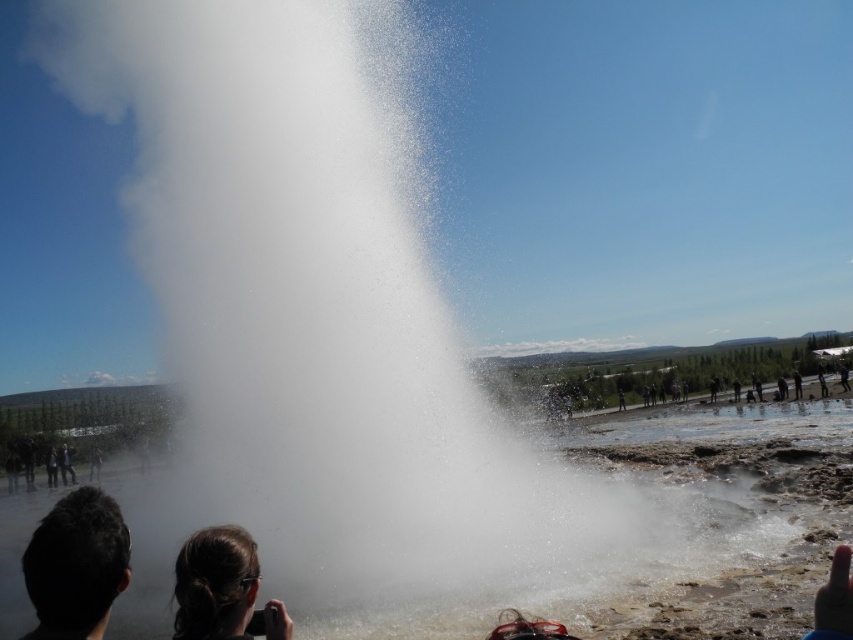
Question: Which of these objects is positioned farthest from the white vapor at center?

Choices:
 (A) dark brown leather jacket at lower left
 (B) dark brown hair at lower left

Answer: (A)

Question: Can you confirm if white vapor at center is wider than dark brown leather jacket at lower left?

Choices:
 (A) yes
 (B) no

Answer: (A)

Question: Which point is closer to the camera?

Choices:
 (A) dark brown leather jacket at lower left
 (B) white vapor at center

Answer: (B)

Question: Is white vapor at center bigger than dark brown hair at lower left?

Choices:
 (A) yes
 (B) no

Answer: (A)

Question: Considering the relative positions of dark brown hair at lower center and dark brown leather jacket at lower left in the image provided, where is dark brown hair at lower center located with respect to dark brown leather jacket at lower left?

Choices:
 (A) above
 (B) below

Answer: (A)

Question: Based on their relative distances, which object is nearer to the dark brown leather jacket at lower left?

Choices:
 (A) white vapor at center
 (B) dark brown hair at lower center
 (C) dark brown hair at lower left

Answer: (A)